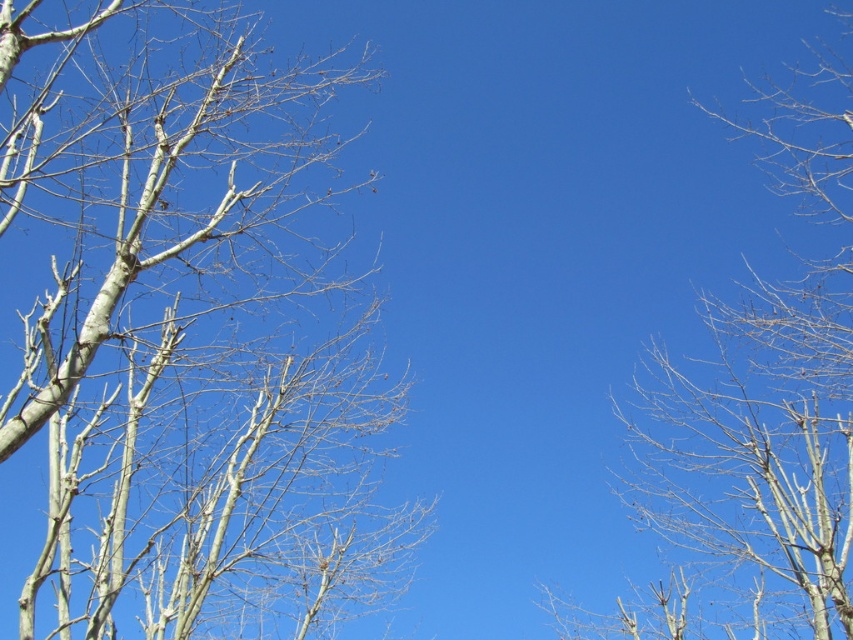
Is point (51, 173) closer to viewer compared to point (782, 433)?

Yes, point (51, 173) is closer to viewer.

This screenshot has height=640, width=853. What do you see at coordinates (186, 333) in the screenshot?
I see `white bark tree at left` at bounding box center [186, 333].

At what (x,y) coordinates should I click in order to perform the action: click on white bark tree at left. Please return your answer as a coordinate pair (x, y). This screenshot has height=640, width=853. Looking at the image, I should click on (186, 333).